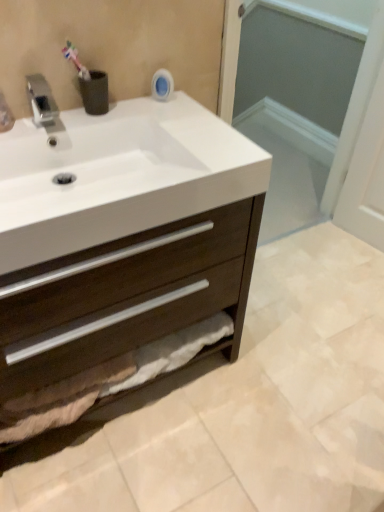
Question: From the image's perspective, is dark wood cabinet at center located above transparent glass screen door at upper center?

Choices:
 (A) yes
 (B) no

Answer: (B)

Question: From the image's perspective, would you say dark wood cabinet at center is shown under transparent glass screen door at upper center?

Choices:
 (A) no
 (B) yes

Answer: (B)

Question: Considering the relative positions of dark wood cabinet at center and transparent glass screen door at upper center in the image provided, is dark wood cabinet at center to the left of transparent glass screen door at upper center from the viewer's perspective?

Choices:
 (A) no
 (B) yes

Answer: (B)

Question: From a real-world perspective, is dark wood cabinet at center below transparent glass screen door at upper center?

Choices:
 (A) yes
 (B) no

Answer: (A)

Question: Does dark wood cabinet at center contain transparent glass screen door at upper center?

Choices:
 (A) yes
 (B) no

Answer: (B)

Question: Is dark wood cabinet at center smaller than transparent glass screen door at upper center?

Choices:
 (A) no
 (B) yes

Answer: (A)

Question: Is silver metallic faucet at upper left not inside transparent glass screen door at upper center?

Choices:
 (A) yes
 (B) no

Answer: (A)

Question: From a real-world perspective, is silver metallic faucet at upper left on transparent glass screen door at upper center?

Choices:
 (A) no
 (B) yes

Answer: (B)

Question: Is silver metallic faucet at upper left not near transparent glass screen door at upper center?

Choices:
 (A) yes
 (B) no

Answer: (A)

Question: From the image's perspective, is silver metallic faucet at upper left on transparent glass screen door at upper center?

Choices:
 (A) yes
 (B) no

Answer: (B)

Question: Is silver metallic faucet at upper left thinner than transparent glass screen door at upper center?

Choices:
 (A) yes
 (B) no

Answer: (A)

Question: From a real-world perspective, does silver metallic faucet at upper left sit lower than transparent glass screen door at upper center?

Choices:
 (A) yes
 (B) no

Answer: (B)

Question: Does dark wood cabinet at center have a greater height compared to white glossy sink at upper left?

Choices:
 (A) no
 (B) yes

Answer: (B)